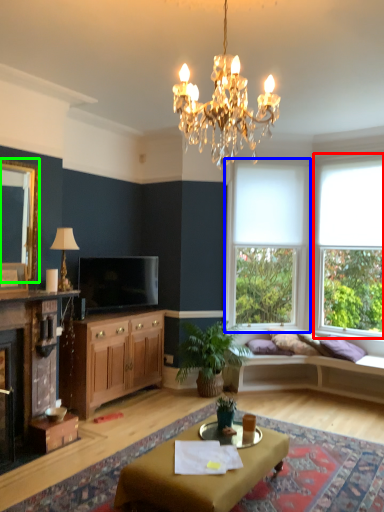
Question: Which object is the farthest from window (highlighted by a red box)? Choose among these: window (highlighted by a blue box) or mirror (highlighted by a green box).

Choices:
 (A) window
 (B) mirror

Answer: (B)